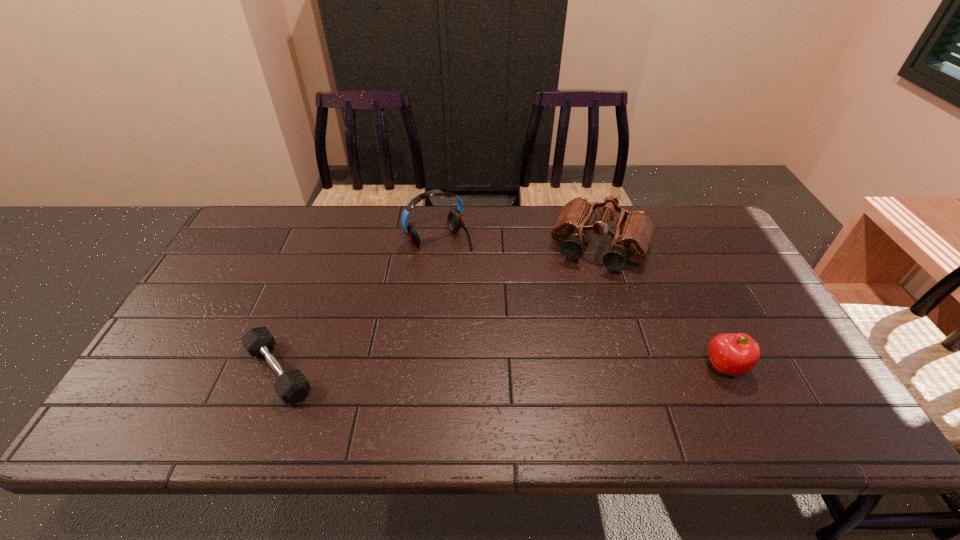
This screenshot has width=960, height=540. What are the coordinates of `vacant area that lies between the headset and the apple` in the screenshot? It's located at (582, 303).

Find the location of a particular element. This screenshot has width=960, height=540. free space that is in between the tallest object and the second tallest object is located at coordinates (520, 244).

At what (x,y) coordinates should I click in order to perform the action: click on blank region between the leftmost object and the third shortest object. Please return your answer as a coordinate pair (x, y). The width and height of the screenshot is (960, 540). Looking at the image, I should click on (440, 309).

What are the coordinates of `vacant area between the second tallest object and the tallest object` in the screenshot? It's located at (520, 244).

Locate an element on the screen. This screenshot has height=540, width=960. free space that is in between the second tallest object and the dumbbell is located at coordinates (440, 309).

Identify the location of empty location between the second object from left to right and the binoculars. (520, 244).

Locate an element on the screen. The image size is (960, 540). unoccupied position between the dumbbell and the second shortest object is located at coordinates (501, 369).

The height and width of the screenshot is (540, 960). Identify the location of the closest object to the tallest object. tap(633, 233).

The image size is (960, 540). What are the coordinates of `object that can be found as the second closest to the third object from right to left` in the screenshot? It's located at (292, 385).

Image resolution: width=960 pixels, height=540 pixels. In order to click on free space in the image that satisfies the following two spatial constraints: 1. on the front side of the headset; 2. on the right side of the second shortest object in this screenshot , I will do `click(426, 368)`.